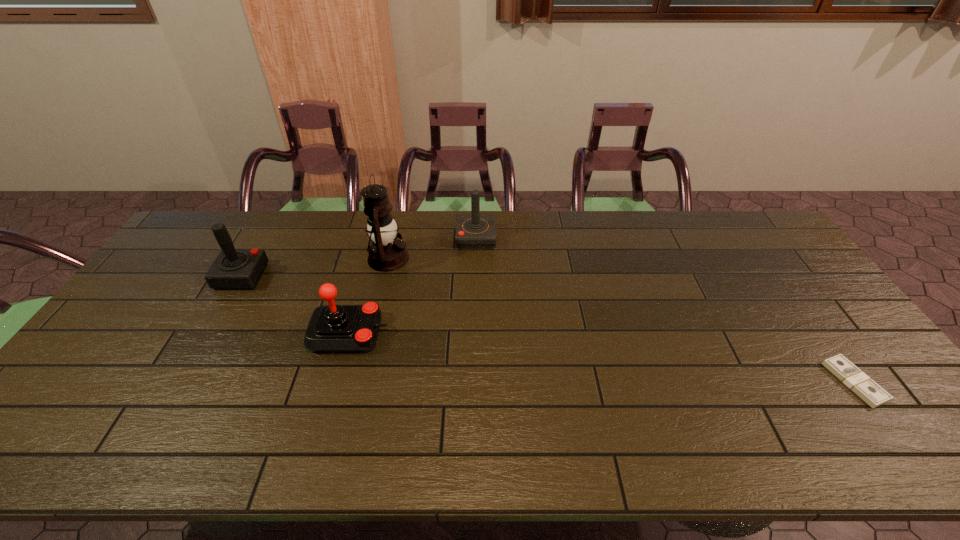
Find the location of a particular element. This screenshot has width=960, height=540. blank area located 0.100m on the base of the second farthest joystick is located at coordinates (295, 276).

Image resolution: width=960 pixels, height=540 pixels. Find the location of `vacant space located 0.190m on the rectangular base of the fourth object from left to right`. vacant space located 0.190m on the rectangular base of the fourth object from left to right is located at coordinates (550, 238).

Image resolution: width=960 pixels, height=540 pixels. I want to click on free region located 0.150m on the base of the fourth farthest object, so click(x=443, y=333).

The width and height of the screenshot is (960, 540). I want to click on vacant space situated 0.200m on the left of the rightmost object, so click(x=754, y=382).

You are a GUI agent. You are given a task and a screenshot of the screen. Output one action in this format:
    pyautogui.click(x=<x>, y=<y>)
    Task: Click on the lantern that is at the far edge
    
    Given the screenshot: What is the action you would take?
    pyautogui.click(x=387, y=253)

Image resolution: width=960 pixels, height=540 pixels. What are the coordinates of `joystick located at the far edge` in the screenshot? It's located at (475, 231).

Where is `object that is positioned at the right edge`? The width and height of the screenshot is (960, 540). object that is positioned at the right edge is located at coordinates (868, 390).

Locate an element on the screen. The height and width of the screenshot is (540, 960). free space at the far edge of the desktop is located at coordinates (538, 242).

Image resolution: width=960 pixels, height=540 pixels. I want to click on vacant region at the near edge of the desktop, so click(108, 434).

Identify the location of vacant space at the right edge of the desktop. (850, 332).